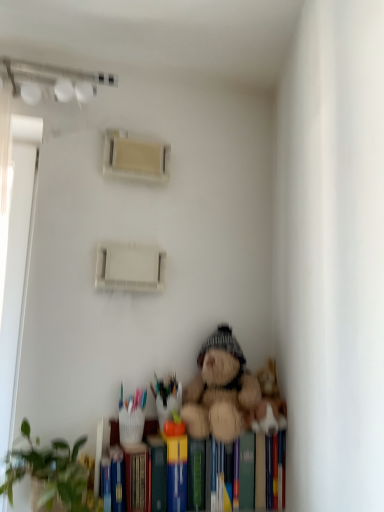
What do you see at coordinates (117, 479) in the screenshot?
I see `hardcover book at lower center` at bounding box center [117, 479].

I want to click on fuzzy brown teddy bear at lower center, so click(x=220, y=390).

Measure the distance between point (241, 372) and camera.

The depth of point (241, 372) is 1.44 meters.

Find the location of a particular element. This screenshot has width=384, height=512. hardcover books at lower center is located at coordinates (107, 434).

The image size is (384, 512). What are the coordinates of `green matte plant at lower left` in the screenshot? It's located at (52, 474).

I want to click on hardcover book at lower center, so click(117, 479).

Can you confirm if hardcover books at lower center is shorter than fuzzy brown teddy bear at lower center?

Indeed, hardcover books at lower center has a lesser height compared to fuzzy brown teddy bear at lower center.

Is hardcover books at lower center facing away from fuzzy brown teddy bear at lower center?

That's not correct — hardcover books at lower center is not looking away from fuzzy brown teddy bear at lower center.

What's the angular difference between hardcover books at lower center and fuzzy brown teddy bear at lower center's facing directions?

The angle between the facing direction of hardcover books at lower center and the facing direction of fuzzy brown teddy bear at lower center is 1.35 degrees.

From the image's perspective, which one is positioned higher, hardcover books at lower center or fuzzy brown teddy bear at lower center?

fuzzy brown teddy bear at lower center appears higher in the image.

From a real-world perspective, is fuzzy brown teddy bear at lower center beneath green matte plant at lower left?

Actually, fuzzy brown teddy bear at lower center is physically above green matte plant at lower left in the real world.

Is fuzzy brown teddy bear at lower center oriented away from green matte plant at lower left?

No, fuzzy brown teddy bear at lower center is not facing away from green matte plant at lower left.

Is fuzzy brown teddy bear at lower center taller or shorter than green matte plant at lower left?

Clearly, fuzzy brown teddy bear at lower center is taller compared to green matte plant at lower left.

From the image's perspective, is fuzzy brown teddy bear at lower center located above green matte plant at lower left?

Yes, from the image's perspective, fuzzy brown teddy bear at lower center is on top of green matte plant at lower left.

Consider the image. Is green matte plant at lower left oriented towards hardcover book at lower center?

No, green matte plant at lower left is not aimed at hardcover book at lower center.

From the image's perspective, is green matte plant at lower left located above hardcover book at lower center?

Indeed, from the image's perspective, green matte plant at lower left is shown above hardcover book at lower center.

How much distance is there between green matte plant at lower left and hardcover book at lower center?

green matte plant at lower left is 7.17 inches away from hardcover book at lower center.

Based on the photo, which of these two, green matte plant at lower left or hardcover book at lower center, is smaller?

hardcover book at lower center is smaller.

Would you say hardcover book at lower center is to the left or to the right of hardcover books at lower center in the picture?

hardcover book at lower center is positioned on hardcover books at lower center's left side.

Is the position of hardcover book at lower center less distant than that of hardcover books at lower center?

Yes.

In the scene shown: Measure the distance between hardcover book at lower center and hardcover books at lower center.

hardcover book at lower center is 2.86 inches from hardcover books at lower center.

Looking at the image, does hardcover book at lower center seem bigger or smaller compared to hardcover books at lower center?

In the image, hardcover book at lower center appears to be smaller than hardcover books at lower center.

Is green matte plant at lower left surrounded by hardcover book at lower center?

That's incorrect, green matte plant at lower left is not inside hardcover book at lower center.

Based on the photo, between hardcover book at lower center and green matte plant at lower left, which one has smaller size?

hardcover book at lower center.

Considering the sizes of objects hardcover book at lower center and green matte plant at lower left in the image provided, who is thinner, hardcover book at lower center or green matte plant at lower left?

Thinner between the two is hardcover book at lower center.

In the scene shown: Between hardcover book at lower center and green matte plant at lower left, which one is positioned in front?

Positioned in front is green matte plant at lower left.

Is fuzzy brown teddy bear at lower center smaller than hardcover book at lower center?

No.

From a real-world perspective, is fuzzy brown teddy bear at lower center physically located above or below hardcover book at lower center?

Clearly, from a real-world perspective, fuzzy brown teddy bear at lower center is above hardcover book at lower center.

Image resolution: width=384 pixels, height=512 pixels. What are the coordinates of `paperback book below the fuzzy brown teddy bear at lower center (from the image's perspective)` in the screenshot? It's located at (117, 479).

Between hardcover book at lower center and fuzzy brown teddy bear at lower center, which one has more height?

fuzzy brown teddy bear at lower center.

Where is `paperback book behind the fuzzy brown teddy bear at lower center`? paperback book behind the fuzzy brown teddy bear at lower center is located at coordinates (117, 479).

From the image's perspective, which object appears higher, hardcover book at lower center or fuzzy brown teddy bear at lower center?

fuzzy brown teddy bear at lower center, from the image's perspective.

Measure the distance between hardcover book at lower center and fuzzy brown teddy bear at lower center.

A distance of 13.80 inches exists between hardcover book at lower center and fuzzy brown teddy bear at lower center.

Locate an element on the screen. This screenshot has height=512, width=384. bookshelf behind the fuzzy brown teddy bear at lower center is located at coordinates (107, 434).

Where is `houseplant located underneath the fuzzy brown teddy bear at lower center (from a real-world perspective)`? The height and width of the screenshot is (512, 384). houseplant located underneath the fuzzy brown teddy bear at lower center (from a real-world perspective) is located at coordinates (52, 474).

From the image, which object appears to be nearer to green matte plant at lower left, fuzzy brown teddy bear at lower center or hardcover book at lower center?

hardcover book at lower center is positioned closer to the anchor green matte plant at lower left.

From the image, which object appears to be farther from fuzzy brown teddy bear at lower center, green matte plant at lower left or hardcover books at lower center?

green matte plant at lower left is positioned further to the anchor fuzzy brown teddy bear at lower center.

Based on their spatial positions, is hardcover book at lower center or green matte plant at lower left further from fuzzy brown teddy bear at lower center?

green matte plant at lower left.

Estimate the real-world distances between objects in this image. Which object is further from hardcover book at lower center, green matte plant at lower left or fuzzy brown teddy bear at lower center?

The object further to hardcover book at lower center is fuzzy brown teddy bear at lower center.

From the image, which object appears to be nearer to hardcover books at lower center, hardcover book at lower center or green matte plant at lower left?

hardcover book at lower center lies closer to hardcover books at lower center than the other object.

Considering their positions, is fuzzy brown teddy bear at lower center positioned closer to hardcover book at lower center than green matte plant at lower left?

Among the two, green matte plant at lower left is located nearer to hardcover book at lower center.

Estimate the real-world distances between objects in this image. Which object is further from green matte plant at lower left, hardcover books at lower center or fuzzy brown teddy bear at lower center?

Among the two, fuzzy brown teddy bear at lower center is located further to green matte plant at lower left.

Which object lies nearer to the anchor point hardcover books at lower center, fuzzy brown teddy bear at lower center or hardcover book at lower center?

hardcover book at lower center lies closer to hardcover books at lower center than the other object.

Where is `bookshelf situated between hardcover book at lower center and fuzzy brown teddy bear at lower center from left to right`? bookshelf situated between hardcover book at lower center and fuzzy brown teddy bear at lower center from left to right is located at coordinates pos(107,434).

Locate an element on the screen. bookshelf located between green matte plant at lower left and fuzzy brown teddy bear at lower center in the left-right direction is located at coordinates (107, 434).

Identify the location of paperback book situated between green matte plant at lower left and fuzzy brown teddy bear at lower center from left to right. This screenshot has height=512, width=384. (117, 479).

This screenshot has height=512, width=384. What are the coordinates of `paperback book located between green matte plant at lower left and hardcover books at lower center in the left-right direction` in the screenshot? It's located at (117, 479).